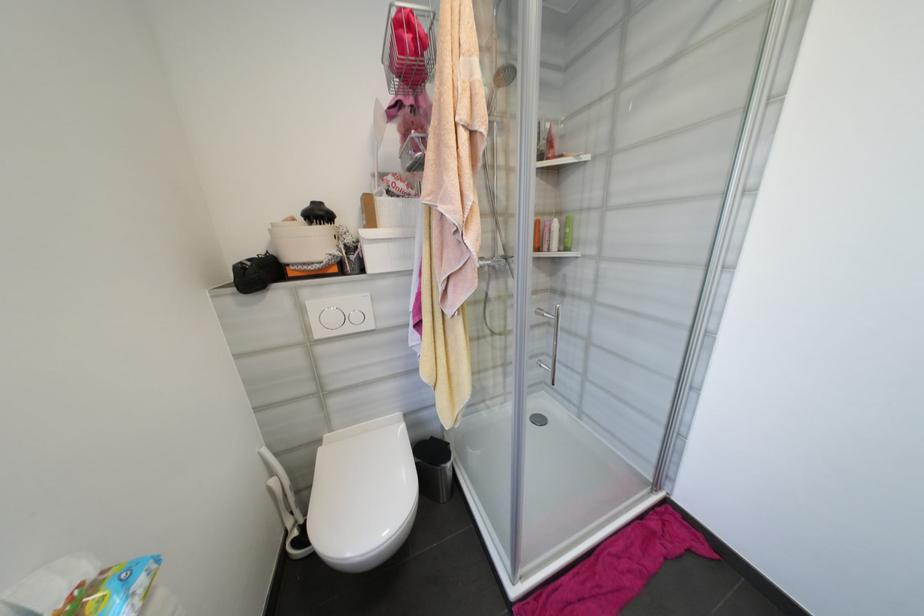
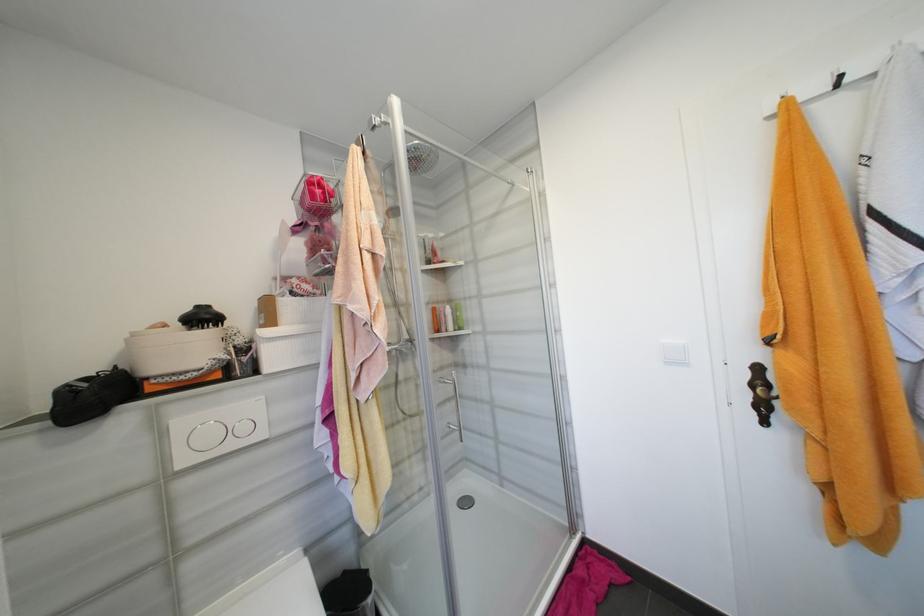
The point at (565, 224) is marked in the first image. Where is the corresponding point in the second image?

(457, 309)